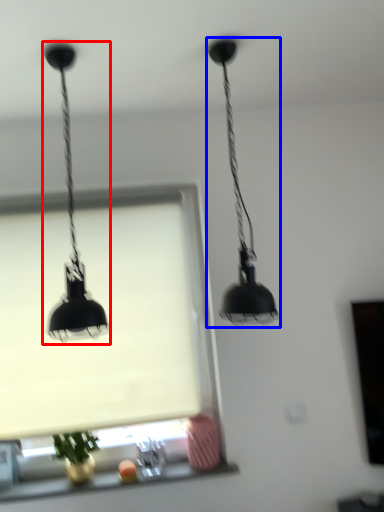
Question: Among these objects, which one is farthest to the camera, lamp (highlighted by a red box) or lamp (highlighted by a blue box)?

Choices:
 (A) lamp
 (B) lamp

Answer: (B)